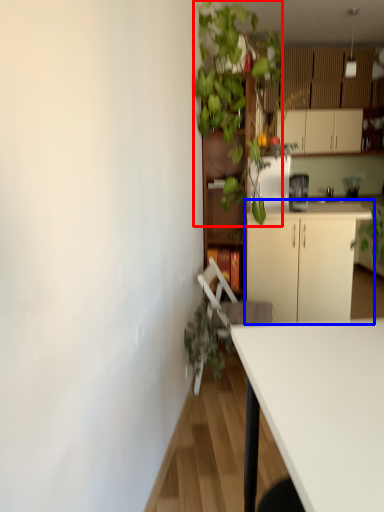
Question: Among these objects, which one is farthest to the camera, vegetation (highlighted by a red box) or cabinetry (highlighted by a blue box)?

Choices:
 (A) vegetation
 (B) cabinetry

Answer: (B)